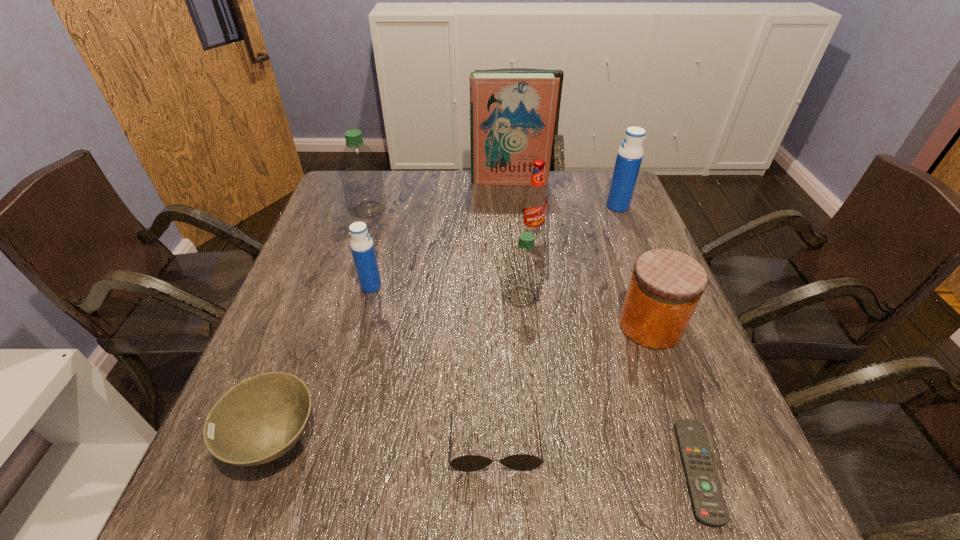
The width and height of the screenshot is (960, 540). I want to click on free point at the far edge, so click(406, 201).

This screenshot has height=540, width=960. What are the coordinates of `free region at the near edge of the desktop` in the screenshot? It's located at (385, 516).

The width and height of the screenshot is (960, 540). I want to click on vacant space at the left edge of the desktop, so click(315, 296).

In the image, there is a desktop. Find the location of `vacant space at the right edge`. vacant space at the right edge is located at coordinates (626, 214).

The height and width of the screenshot is (540, 960). In order to click on vacant space at the far left corner of the desktop in this screenshot , I will do `click(339, 187)`.

Find the location of a particular element. The image size is (960, 540). vacant space that's between the farther green water bottle and the right blue water bottle is located at coordinates [x=492, y=208].

Locate an element on the screen. free space between the right green water bottle and the remote control is located at coordinates (611, 383).

The width and height of the screenshot is (960, 540). I want to click on vacant area between the sunglasses and the third water bottle from left to right, so click(x=508, y=368).

This screenshot has height=540, width=960. Find the location of `unoccupied area between the sunglasses and the shortest object`. unoccupied area between the sunglasses and the shortest object is located at coordinates (596, 455).

At what (x,y) coordinates should I click in order to perform the action: click on free spot between the tallest object and the third shortest object. Please return your answer as a coordinate pair (x, y). The image size is (960, 540). Looking at the image, I should click on (392, 310).